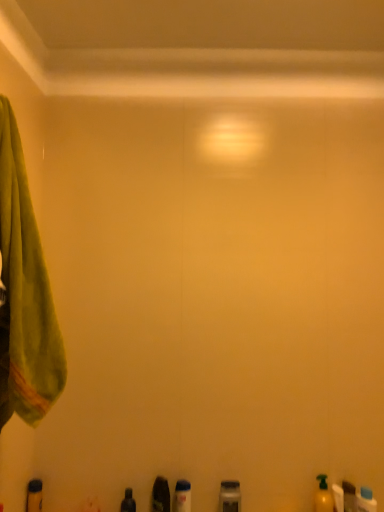
Question: Is shiny black bottle at lower center, the 7th toiletry when ordered from right to left, to the left or to the right of metallic gray container at lower center, the 5th toiletry in the right-to-left sequence, in the image?

Choices:
 (A) right
 (B) left

Answer: (B)

Question: From a real-world perspective, is shiny black bottle at lower center, the 7th toiletry when ordered from right to left, above or below metallic gray container at lower center, arranged as the fourth toiletry when viewed from the left?

Choices:
 (A) below
 (B) above

Answer: (A)

Question: Which object is the closest to the yellow matte bottle at lower right, the fifth toiletry in the left-to-right sequence?

Choices:
 (A) shiny black bottle at lower center, the 7th toiletry when ordered from right to left
 (B) green soft towel at left
 (C) metallic gray container at lower center, arranged as the fourth toiletry when viewed from the left
 (D) blue plastic bottle at lower right, placed as the eighth toiletry when sorted from left to right
 (E) matte black bottle at lower left, arranged as the eighth toiletry when viewed from the right

Answer: (D)

Question: Which of these objects is positioned closest to the yellow matte bottle at lower right, the 4th toiletry when ordered from right to left?

Choices:
 (A) matte black bottle at lower left, arranged as the eighth toiletry when viewed from the right
 (B) yellow matte bottle at lower right, marked as the 6th toiletry in a left-to-right arrangement
 (C) shiny black bottle at lower center, the 7th toiletry when ordered from right to left
 (D) blue plastic bottle at lower right, placed as the first toiletry when sorted from right to left
 (E) translucent plastic bottle at lower center, which is the third toiletry from left to right

Answer: (B)